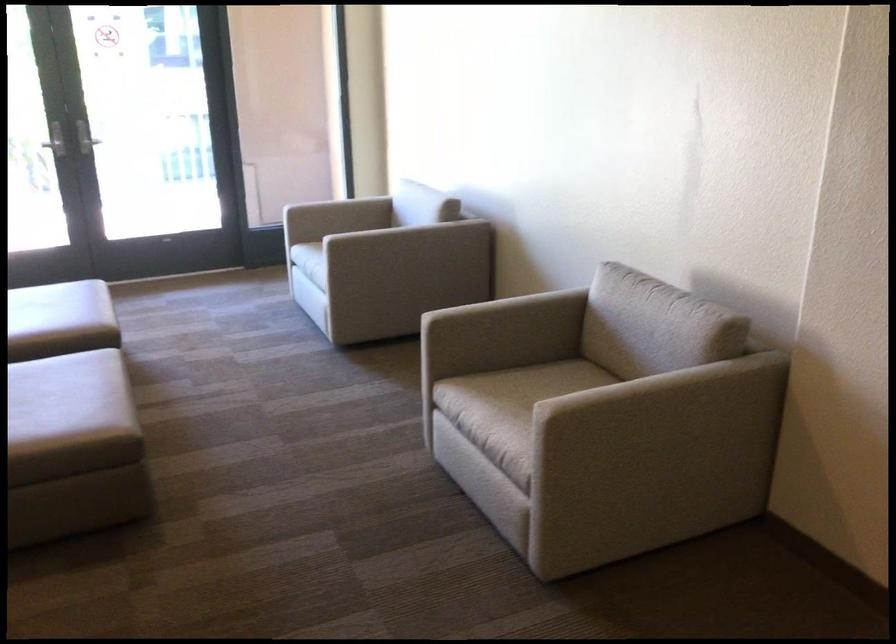
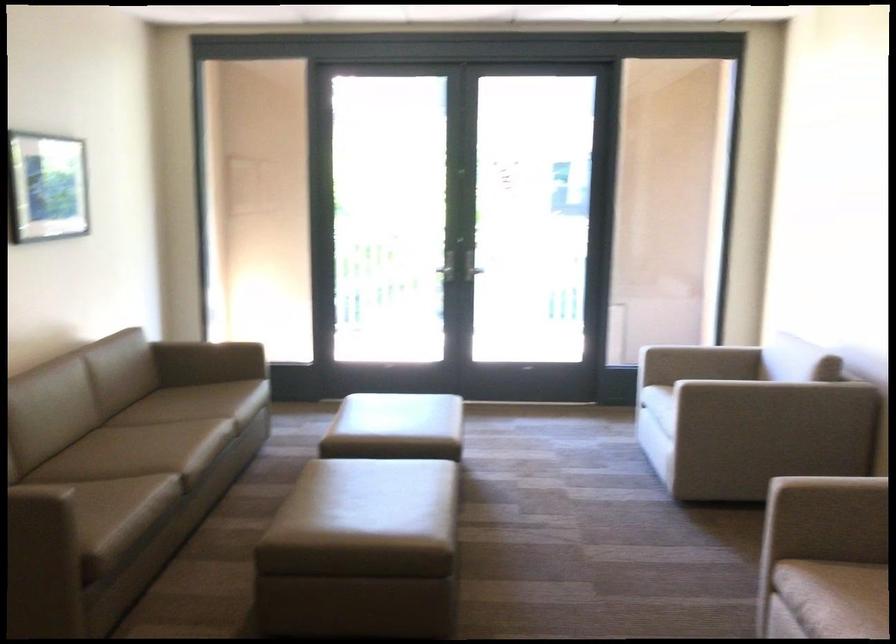
The point at (391, 187) is marked in the first image. Where is the corresponding point in the second image?

(762, 346)